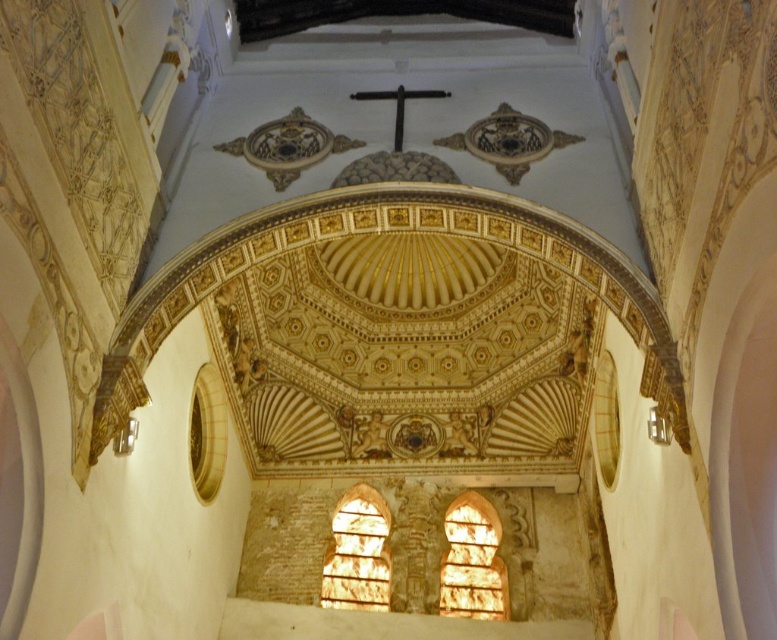
Question: Which point is farther from the camera taking this photo?

Choices:
 (A) (359, 545)
 (B) (507, 600)

Answer: (A)

Question: Can you confirm if translucent glass window at center is positioned to the left of translucent stone window at center?

Choices:
 (A) yes
 (B) no

Answer: (B)

Question: Which of the following is the farthest from the observer?

Choices:
 (A) translucent glass window at center
 (B) translucent stone window at center

Answer: (B)

Question: Does translucent glass window at center appear on the right side of translucent stone window at center?

Choices:
 (A) no
 (B) yes

Answer: (B)

Question: Which point is closer to the camera?

Choices:
 (A) translucent glass window at center
 (B) translucent stone window at center

Answer: (A)

Question: From the image, what is the correct spatial relationship of translucent glass window at center in relation to translucent stone window at center?

Choices:
 (A) below
 (B) above

Answer: (A)